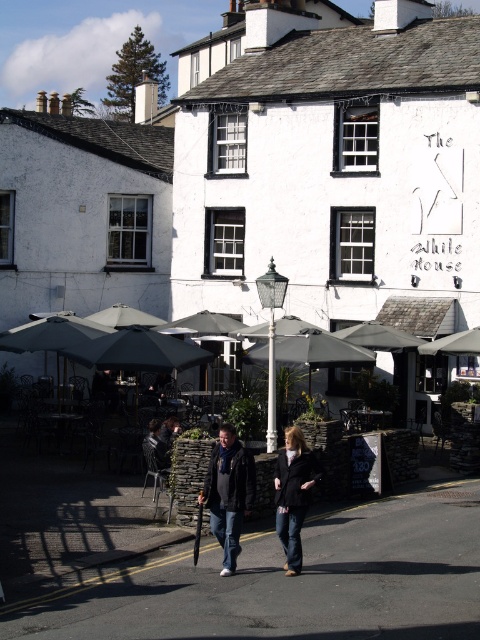
Question: Which point is farther to the camera?

Choices:
 (A) (313, 326)
 (B) (297, 548)

Answer: (A)

Question: Is dark brown leather jacket at center bigger than dark blue jeans at center?

Choices:
 (A) no
 (B) yes

Answer: (B)

Question: Which point is farther to the camera?

Choices:
 (A) (223, 452)
 (B) (108, 330)
 (C) (362, 352)
 (D) (277, 492)

Answer: (B)

Question: Which point is farther to the camera?

Choices:
 (A) (363, 353)
 (B) (229, 513)

Answer: (A)

Question: Can you confirm if denim jacket at center is wider than gray fabric umbrella at center?

Choices:
 (A) yes
 (B) no

Answer: (B)

Question: Does dark blue jeans at center have a smaller size compared to dark grey fabric umbrella at left?

Choices:
 (A) no
 (B) yes

Answer: (A)